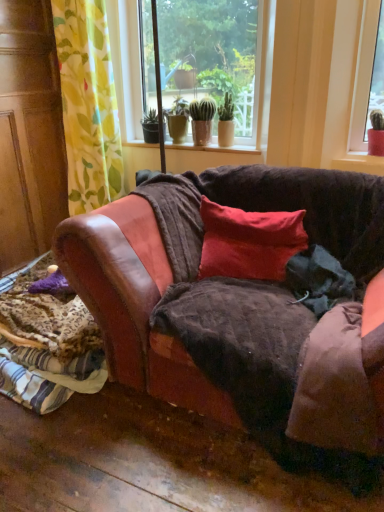
Locate an element on the screen. smooth concrete window sill at center is located at coordinates (212, 149).

The height and width of the screenshot is (512, 384). In order to click on brown leather couch at center in this screenshot , I will do `click(240, 310)`.

The width and height of the screenshot is (384, 512). What do you see at coordinates (222, 59) in the screenshot? I see `matte ceramic pots at center` at bounding box center [222, 59].

You are a GUI agent. You are given a task and a screenshot of the screen. Output one action in this format:
    pyautogui.click(x=<x>, y=<y>)
    Task: Click on the smooth concrete window sill at center
    Image resolution: width=384 pixels, height=512 pixels.
    Given the screenshot: What is the action you would take?
    pyautogui.click(x=212, y=149)

Between matte ceramic pots at center and red velvet pillow at center, which one appears on the right side from the viewer's perspective?

Positioned to the right is red velvet pillow at center.

Is red velvet pillow at center at the back of matte ceramic pots at center?

No.

Does matte ceramic pots at center have a lesser height compared to red velvet pillow at center?

Incorrect, the height of matte ceramic pots at center does not fall short of that of red velvet pillow at center.

Is red velvet pillow at center oriented towards brown leather couch at center?

Yes, red velvet pillow at center is aimed at brown leather couch at center.

In the scene shown: Is red velvet pillow at center bigger or smaller than brown leather couch at center?

Considering their sizes, red velvet pillow at center takes up less space than brown leather couch at center.

Would you say red velvet pillow at center is outside brown leather couch at center?

No, red velvet pillow at center is inside or overlapping with brown leather couch at center.

Is smooth concrete window sill at center in contact with brown leather couch at center?

They are not placed beside each other.

Consider the image. Who is shorter, smooth concrete window sill at center or brown leather couch at center?

With less height is smooth concrete window sill at center.

Considering the positions of points (205, 148) and (152, 314), is point (205, 148) farther from camera compared to point (152, 314)?

Yes, point (205, 148) is behind point (152, 314).

In the scene shown: From the image's perspective, does smooth concrete window sill at center appear higher than brown leather couch at center?

Yes.

From the image's perspective, does brown leather couch at center appear lower than red velvet pillow at center?

Yes, from the image's perspective, brown leather couch at center is below red velvet pillow at center.

Between brown leather couch at center and red velvet pillow at center, which one has less height?

red velvet pillow at center is shorter.

Do you think brown leather couch at center is within red velvet pillow at center, or outside of it?

brown leather couch at center is outside red velvet pillow at center.

Is brown leather couch at center beside red velvet pillow at center?

No, brown leather couch at center is not touching red velvet pillow at center.

Consider the image. Could you tell me if leather couch at lower left is facing matte ceramic pots at center?

No, leather couch at lower left is not aimed at matte ceramic pots at center.

Does point (46, 343) come farther from viewer compared to point (181, 8)?

That is False.

Is leather couch at lower left positioned behind matte ceramic pots at center?

No, the depth of leather couch at lower left is less than that of matte ceramic pots at center.

What's the angular difference between yellow-green floral fabric at left and matte ceramic pots at center's facing directions?

yellow-green floral fabric at left and matte ceramic pots at center are facing 1.12 degrees away from each other.

From a real-world perspective, who is located lower, yellow-green floral fabric at left or matte ceramic pots at center?

yellow-green floral fabric at left is physically lower.

From the image's perspective, which is below, yellow-green floral fabric at left or matte ceramic pots at center?

yellow-green floral fabric at left is shown below in the image.

Is yellow-green floral fabric at left wider than matte ceramic pots at center?

Yes, yellow-green floral fabric at left is wider than matte ceramic pots at center.

In the scene shown: Does brown leather couch at center appear on the left side of matte ceramic pots at center?

Incorrect, brown leather couch at center is not on the left side of matte ceramic pots at center.

From a real-world perspective, is brown leather couch at center under matte ceramic pots at center?

Yes.

Does brown leather couch at center have a lesser height compared to matte ceramic pots at center?

Yes, brown leather couch at center is shorter than matte ceramic pots at center.

Between point (81, 292) and point (221, 11), which one is positioned in front?

The point (81, 292) is closer.

In order to click on pillow in front of the matte ceramic pots at center in this screenshot , I will do `click(249, 242)`.

Where is `pillow that is above the brown leather couch at center (from the image's perspective)`? Image resolution: width=384 pixels, height=512 pixels. pillow that is above the brown leather couch at center (from the image's perspective) is located at coordinates (249, 242).

When comparing their distances from red velvet pillow at center, does yellow-green floral fabric at left or brown leather couch at center seem further?

yellow-green floral fabric at left is further to red velvet pillow at center.

Estimate the real-world distances between objects in this image. Which object is closer to red velvet pillow at center, matte ceramic pots at center or brown leather couch at center?

The object closer to red velvet pillow at center is brown leather couch at center.

Estimate the real-world distances between objects in this image. Which object is further from brown leather couch at center, matte ceramic pots at center or smooth concrete window sill at center?

Based on the image, matte ceramic pots at center appears to be further to brown leather couch at center.

Considering their positions, is matte ceramic pots at center positioned further to leather couch at lower left than smooth concrete window sill at center?

matte ceramic pots at center.

When comparing their distances from leather couch at lower left, does smooth concrete window sill at center or yellow-green floral fabric at left seem closer?

yellow-green floral fabric at left is closer to leather couch at lower left.

Considering their positions, is yellow-green floral fabric at left positioned closer to leather couch at lower left than matte ceramic pots at center?

yellow-green floral fabric at left lies closer to leather couch at lower left than the other object.

Looking at the image, which one is located closer to red velvet pillow at center, matte ceramic pots at center or yellow-green floral fabric at left?

yellow-green floral fabric at left is closer to red velvet pillow at center.

Considering their positions, is matte ceramic pots at center positioned further to yellow-green floral fabric at left than smooth concrete window sill at center?

matte ceramic pots at center lies further to yellow-green floral fabric at left than the other object.

The height and width of the screenshot is (512, 384). I want to click on window sill between matte ceramic pots at center and red velvet pillow at center in the up-down direction, so click(212, 149).

Locate an element on the screen. curtain between matte ceramic pots at center and red velvet pillow at center from top to bottom is located at coordinates pyautogui.click(x=88, y=104).

Where is `pillow between smooth concrete window sill at center and leather couch at lower left from top to bottom`? The width and height of the screenshot is (384, 512). pillow between smooth concrete window sill at center and leather couch at lower left from top to bottom is located at coordinates (249, 242).

Where is `pillow between yellow-green floral fabric at left and leather couch at lower left in the up-down direction`? This screenshot has height=512, width=384. pillow between yellow-green floral fabric at left and leather couch at lower left in the up-down direction is located at coordinates (249, 242).